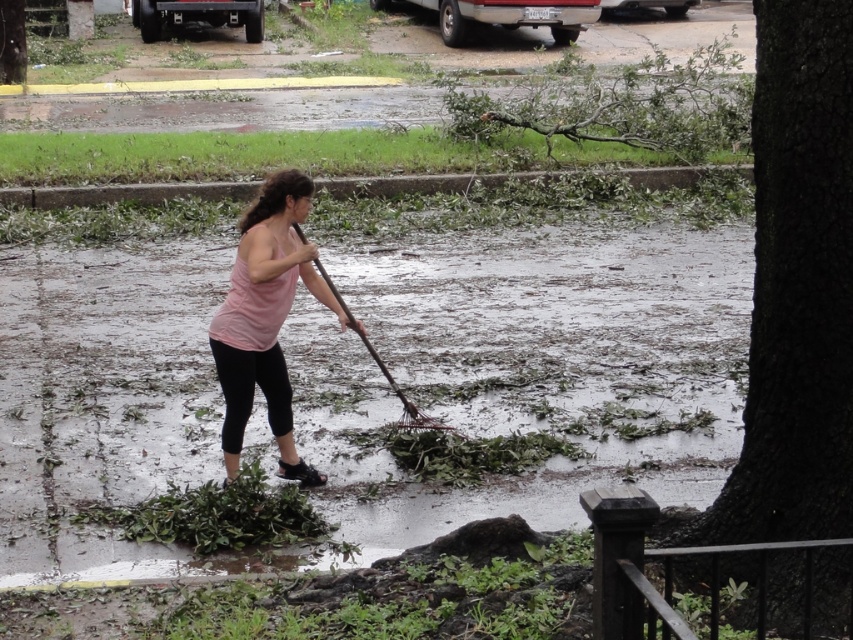
Question: Among these objects, which one is farthest from the camera?

Choices:
 (A) pink fabric tank top at center
 (B) brown wooden rake at center

Answer: (B)

Question: Does pink fabric tank top at center come in front of brown wooden rake at center?

Choices:
 (A) yes
 (B) no

Answer: (A)

Question: Is pink fabric tank top at center thinner than brown wooden rake at center?

Choices:
 (A) yes
 (B) no

Answer: (A)

Question: Considering the relative positions of pink fabric tank top at center and brown wooden rake at center in the image provided, where is pink fabric tank top at center located with respect to brown wooden rake at center?

Choices:
 (A) above
 (B) below

Answer: (B)